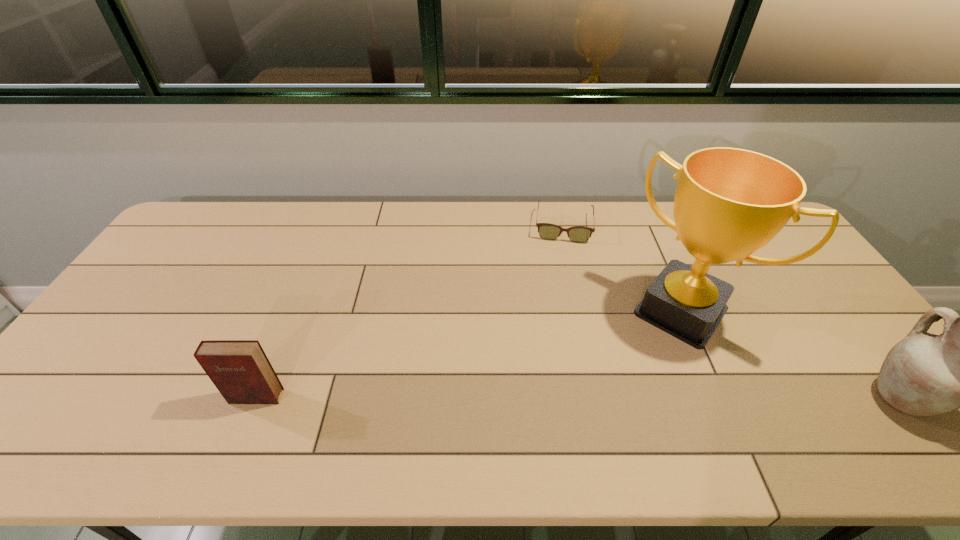
Identify the location of empty space between the farthest object and the award. (622, 269).

Point out which object is positioned as the third nearest to the award. Please provide its 2D coordinates. Your answer should be formatted as a tuple, i.e. [(x, y)], where the tuple contains the x and y coordinates of a point satisfying the conditions above.

[(240, 370)]

I want to click on object that is the closest one to the diary, so click(x=579, y=234).